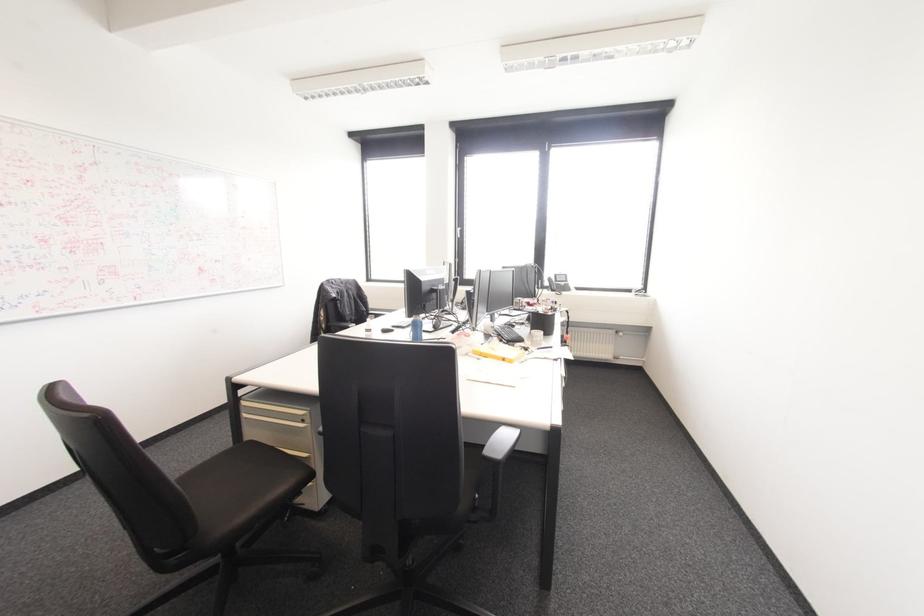
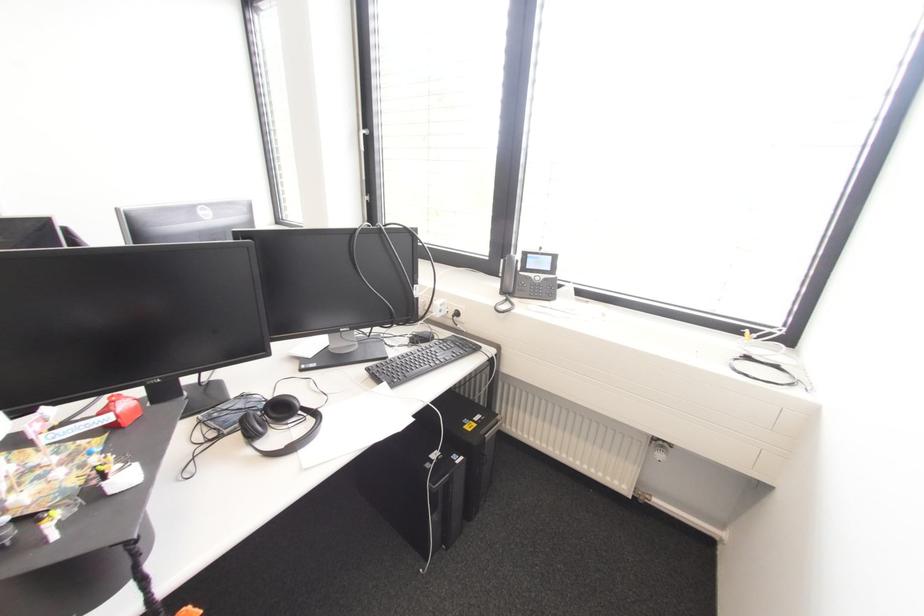
Locate, in the second image, the point that corresponds to the point at 552,290 in the first image.

(503, 292)